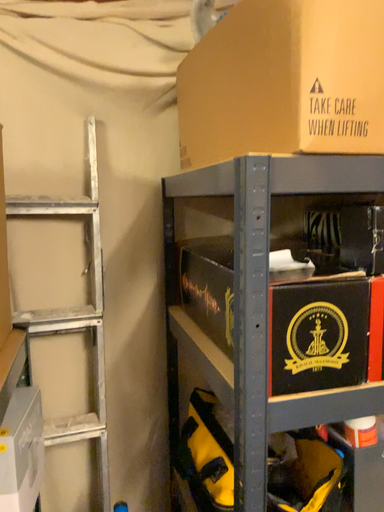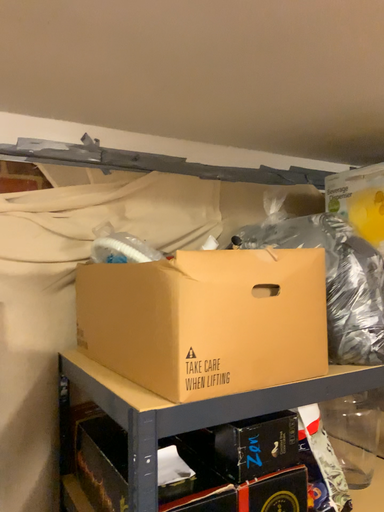
Question: Which way did the camera rotate in the video?

Choices:
 (A) rotated upward
 (B) rotated downward

Answer: (A)